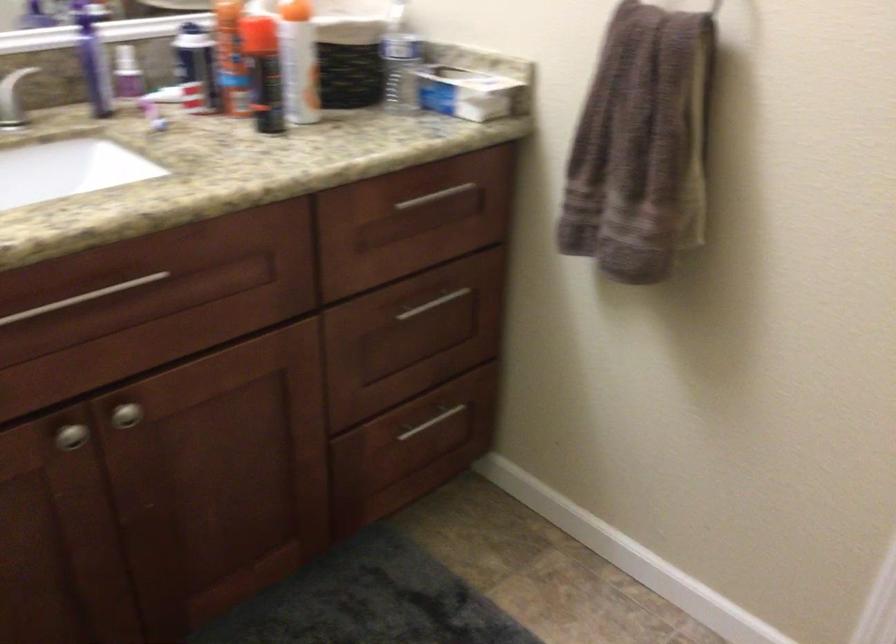
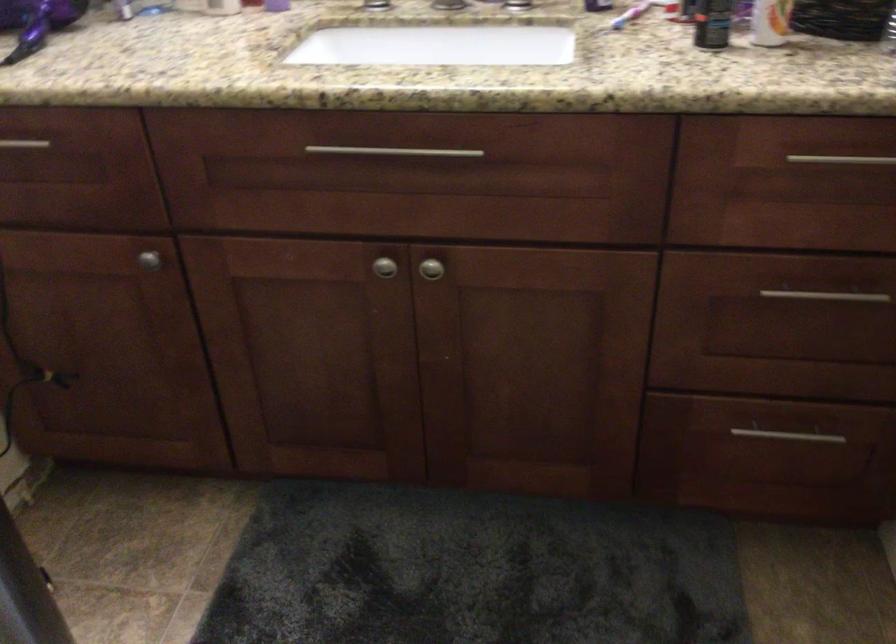
The point at (316, 104) is marked in the first image. Where is the corresponding point in the second image?

(770, 22)